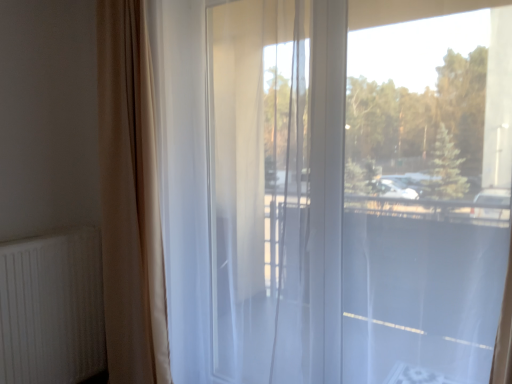
Question: Visually, is transparent glass window at center positioned to the left or to the right of beige fabric curtain at left?

Choices:
 (A) left
 (B) right

Answer: (B)

Question: Is point (166, 1) positioned closer to the camera than point (156, 193)?

Choices:
 (A) farther
 (B) closer

Answer: (B)

Question: Which object is positioned closest to the white ribbed radiator at lower left?

Choices:
 (A) transparent glass window at center
 (B) beige fabric curtain at left

Answer: (B)

Question: Estimate the real-world distances between objects in this image. Which object is farther from the white ribbed radiator at lower left?

Choices:
 (A) beige fabric curtain at left
 (B) transparent glass window at center

Answer: (B)